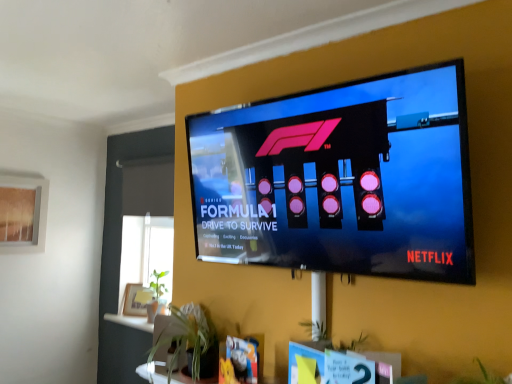
Question: Considering the relative sizes of black glossy tv at upper center and green leafy plant at lower center in the image provided, is black glossy tv at upper center bigger than green leafy plant at lower center?

Choices:
 (A) yes
 (B) no

Answer: (A)

Question: Is black glossy tv at upper center shorter than green leafy plant at lower center?

Choices:
 (A) no
 (B) yes

Answer: (A)

Question: Is black glossy tv at upper center closer to the viewer compared to green leafy plant at lower center?

Choices:
 (A) yes
 (B) no

Answer: (A)

Question: Is black glossy tv at upper center located outside green leafy plant at lower center?

Choices:
 (A) no
 (B) yes

Answer: (B)

Question: Is black glossy tv at upper center positioned with its back to green leafy plant at lower center?

Choices:
 (A) no
 (B) yes

Answer: (A)

Question: Is the position of black glossy tv at upper center more distant than that of green leafy plant at lower center?

Choices:
 (A) yes
 (B) no

Answer: (B)

Question: Could translucent glass window screen at upper left be considered to be inside black glossy tv at upper center?

Choices:
 (A) yes
 (B) no

Answer: (B)

Question: Is black glossy tv at upper center shorter than translucent glass window screen at upper left?

Choices:
 (A) no
 (B) yes

Answer: (A)

Question: Is black glossy tv at upper center outside translucent glass window screen at upper left?

Choices:
 (A) no
 (B) yes

Answer: (B)

Question: From a real-world perspective, is black glossy tv at upper center positioned over translucent glass window screen at upper left based on gravity?

Choices:
 (A) yes
 (B) no

Answer: (A)

Question: Is there a large distance between black glossy tv at upper center and translucent glass window screen at upper left?

Choices:
 (A) yes
 (B) no

Answer: (A)

Question: Does black glossy tv at upper center have a smaller size compared to translucent glass window screen at upper left?

Choices:
 (A) no
 (B) yes

Answer: (A)

Question: Is the position of green leafy plant at lower center less distant than that of translucent glass window screen at upper left?

Choices:
 (A) yes
 (B) no

Answer: (A)